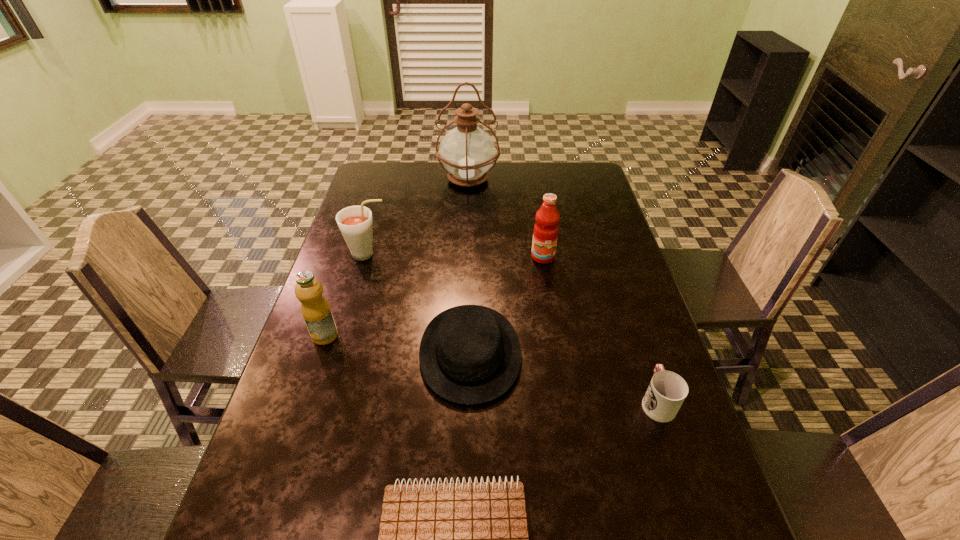
Locate an element on the screen. This screenshot has height=540, width=960. blank region between the farther fruit juice and the fedora is located at coordinates (507, 305).

Where is `free point between the tallest object and the left fruit juice`? Image resolution: width=960 pixels, height=540 pixels. free point between the tallest object and the left fruit juice is located at coordinates (396, 257).

What are the coordinates of `object that ranks as the fifth closest to the nearest object` in the screenshot? It's located at (355, 222).

Locate which object ranks fourth in proximity to the shortest object. Please provide its 2D coordinates. Your answer should be formatted as a tuple, i.e. [(x, y)], where the tuple contains the x and y coordinates of a point satisfying the conditions above.

[(545, 234)]

I want to click on free location that satisfies the following two spatial constraints: 1. on the handle side of the rightmost object; 2. on the drink side of the root beer, so click(x=609, y=254).

You are a GUI agent. You are given a task and a screenshot of the screen. Output one action in this format:
    pyautogui.click(x=<x>, y=<y>)
    Task: Click on the vacant space that satisfies the following two spatial constraints: 1. on the handle side of the cup; 2. on the drink side of the root beer
    The image size is (960, 540).
    Given the screenshot: What is the action you would take?
    click(x=609, y=254)

The width and height of the screenshot is (960, 540). In order to click on blank space that satisfies the following two spatial constraints: 1. on the drink side of the root beer; 2. on the handle side of the rightmost object in this screenshot , I will do `click(325, 401)`.

Where is `vacant region that satisfies the following two spatial constraints: 1. on the drink side of the root beer; 2. on the handle side of the rightmost object`? This screenshot has height=540, width=960. vacant region that satisfies the following two spatial constraints: 1. on the drink side of the root beer; 2. on the handle side of the rightmost object is located at coordinates (325, 401).

Locate an element on the screen. Image resolution: width=960 pixels, height=540 pixels. vacant region that satisfies the following two spatial constraints: 1. on the front side of the farthest object; 2. on the left side of the fedora is located at coordinates (462, 353).